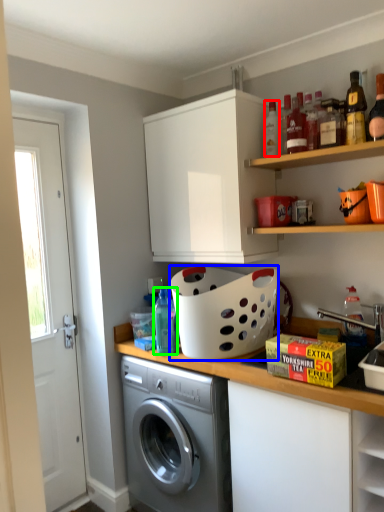
Question: Which object is the farthest from bottle (highlighted by a red box)? Choose among these: basket (highlighted by a blue box) or bottle (highlighted by a green box).

Choices:
 (A) basket
 (B) bottle

Answer: (B)